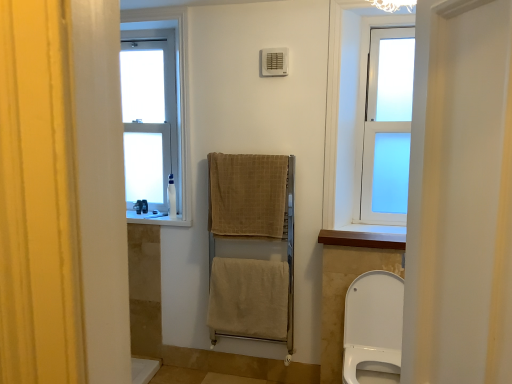
Where is `empty space that is ontop of beige cotton towel at center, arranged as the 3th bath towel when viewed from the top`? empty space that is ontop of beige cotton towel at center, arranged as the 3th bath towel when viewed from the top is located at coordinates (244, 263).